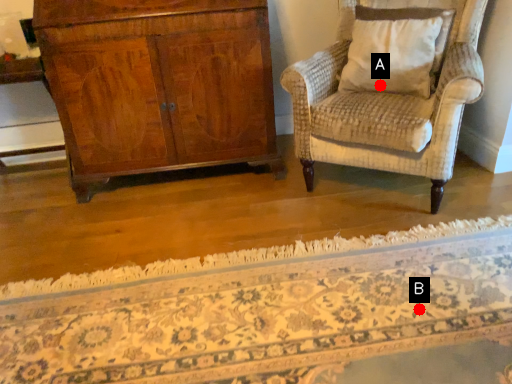
Question: Two points are circled on the image, labeled by A and B beside each circle. Which point is further to the camera?

Choices:
 (A) A is further
 (B) B is further

Answer: (A)